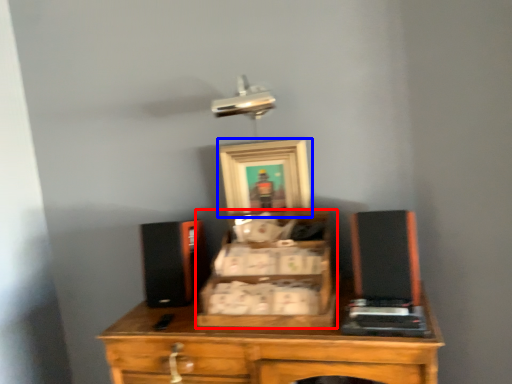
Question: Among these objects, which one is nearest to the camera, drawer (highlighted by a red box) or picture frame (highlighted by a blue box)?

Choices:
 (A) drawer
 (B) picture frame

Answer: (A)